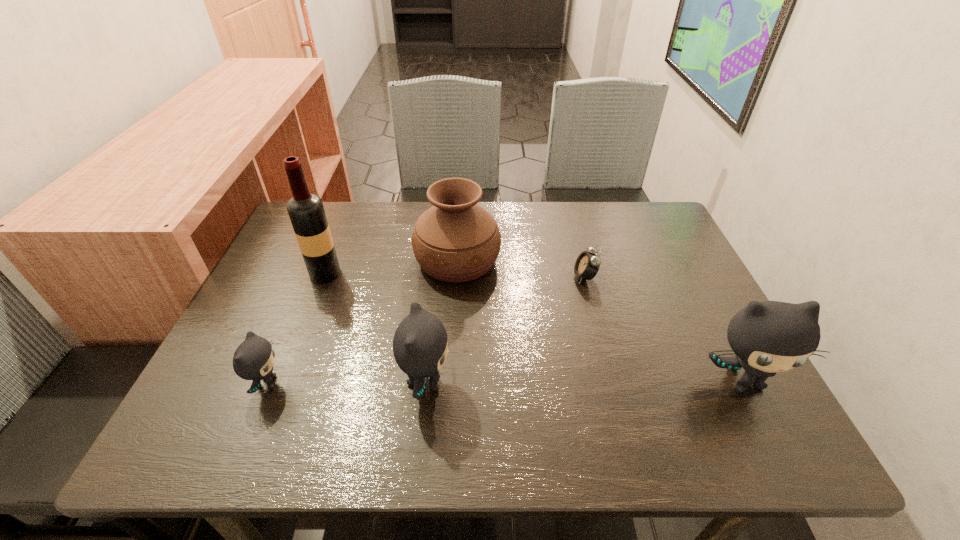
To achieve even spacing by inserting another kitten among them, please point to a vacant spot for this new kitten. Please provide its 2D coordinates. Your answer should be formatted as a tuple, i.e. [(x, y)], where the tuple contains the x and y coordinates of a point satisfying the conditions above.

[(585, 381)]